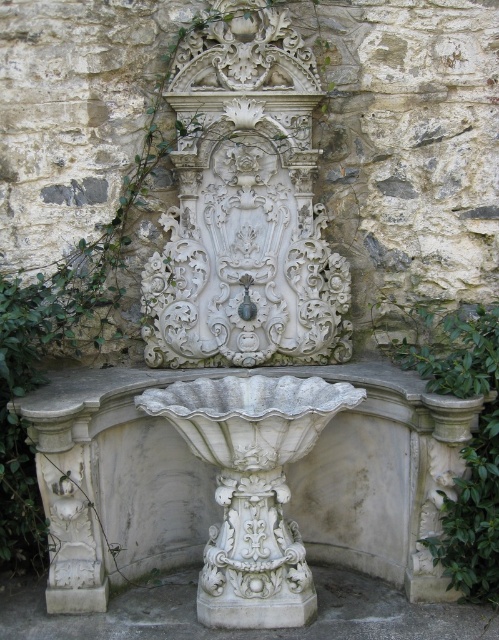
You are standing in front of the fountain and want to touch both the white stone pedestal at center and the green leafy ivy at right. Which object should you reach for first to touch the one closer to you?

You should reach for the white stone pedestal at center first because it is closer to you than the green leafy ivy at right.

You are a gardener trying to place a new potted plant that is 20 inches wide between the white stone pedestal at center and the green leafy ivy at right. Based on the image, will the plant fit in the space between them?

The distance between the white stone pedestal at center and the green leafy ivy at right is 22.18 inches. Since the potted plant is 20 inches wide, it will fit in the space between them as there is enough room.